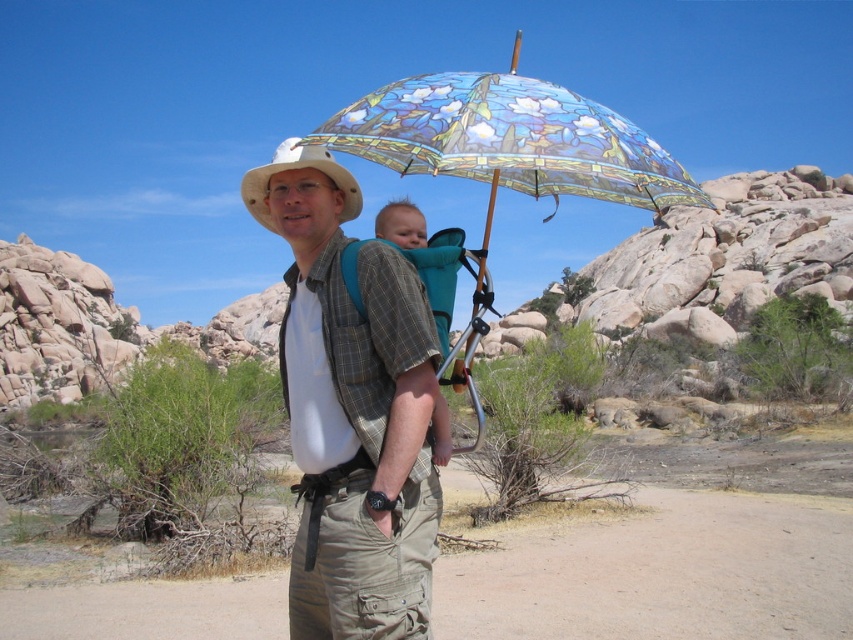
Based on the coordinates provided, which object is located at point (352,410)?

The point (352,410) corresponds to the plaid shirt at center.

Based on the photo, you are a photographer trying to capture the man and the baby in the desert scene. To ensure the white matte cowboy hat at center is visible in the frame, where should you position the camera relative to the man?

The white matte cowboy hat at center is located at point [297,168], so you should position the camera directly facing the man to ensure the hat is centered in the frame.

You are a drone operator trying to capture a photo of the man and the baby. The camera has a maximum focus range of 30 meters. Given the distance between the point at (345,189) and the man, will the camera be able to focus on both subjects clearly?

The distance between the point at (345,189) and the man is 34.45 meters, which exceeds the camera maximum focus range of 30 meters. Therefore, the camera cannot focus on both subjects clearly.